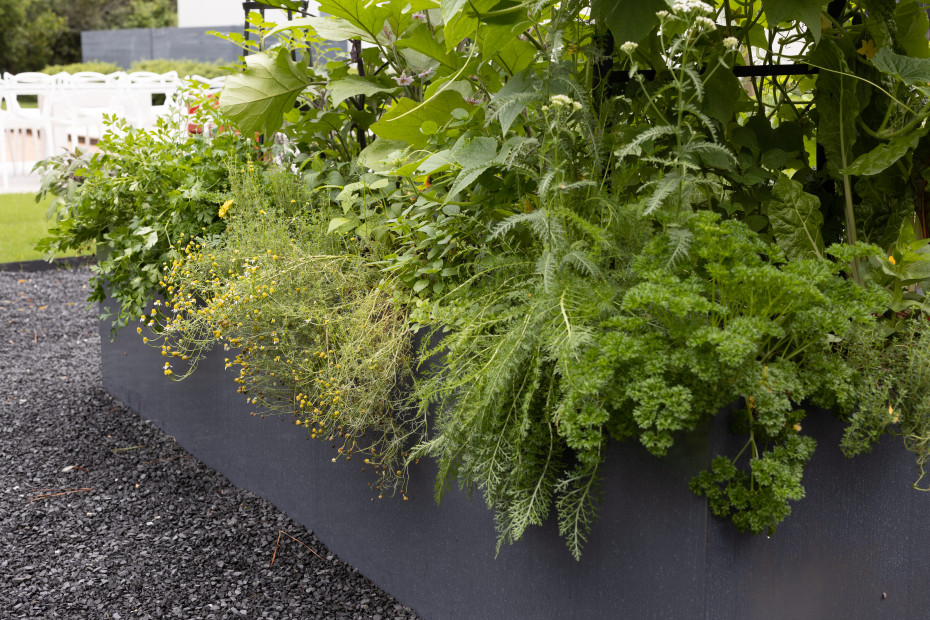
This screenshot has height=620, width=930. Identify the location of chair. (93, 85), (151, 87), (31, 77), (204, 79).